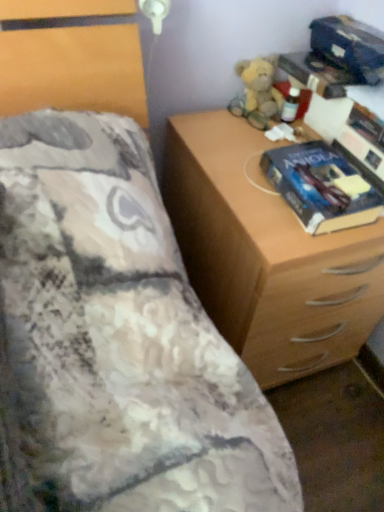
Describe the element at coordinates (266, 255) in the screenshot. I see `wooden chest of drawers at right` at that location.

I want to click on wooden chest of drawers at right, so click(266, 255).

This screenshot has width=384, height=512. Find the location of `fluffy beige teddy bear at upper right`. fluffy beige teddy bear at upper right is located at coordinates (257, 92).

Could you tell me if blue glossy paperback book at right is turned towards wooden chest of drawers at right?

No.

Considering the relative positions of blue glossy paperback book at right and wooden chest of drawers at right in the image provided, is blue glossy paperback book at right to the right of wooden chest of drawers at right from the viewer's perspective?

Yes.

Could fluffy beige teddy bear at upper right be considered to be inside blue glossy paperback book at right?

No, fluffy beige teddy bear at upper right is not a part of blue glossy paperback book at right.

Is blue glossy paperback book at right in front of or behind fluffy beige teddy bear at upper right in the image?

Clearly, blue glossy paperback book at right is in front of fluffy beige teddy bear at upper right.

Could you tell me if blue glossy paperback book at right is facing fluffy beige teddy bear at upper right?

No, blue glossy paperback book at right is not aimed at fluffy beige teddy bear at upper right.

Can you confirm if blue glossy paperback book at right is thinner than fluffy beige teddy bear at upper right?

Incorrect, the width of blue glossy paperback book at right is not less than that of fluffy beige teddy bear at upper right.

What's the angular difference between wooden chest of drawers at right and blue glossy paperback book at right's facing directions?

0.149 degrees.

Is wooden chest of drawers at right aimed at blue glossy paperback book at right?

No, wooden chest of drawers at right is not facing towards blue glossy paperback book at right.

Based on the photo, which is more to the right, wooden chest of drawers at right or blue glossy paperback book at right?

blue glossy paperback book at right.

Looking at this image, from a real-world perspective, is wooden chest of drawers at right on blue glossy paperback book at right?

No, from a real-world perspective, wooden chest of drawers at right is not on top of blue glossy paperback book at right.

In order to click on paperback book that appears below the fluffy beige teddy bear at upper right (from the image's perspective) in this screenshot , I will do `click(321, 187)`.

Measure the distance from fluffy beige teddy bear at upper right to blue glossy paperback book at right.

fluffy beige teddy bear at upper right and blue glossy paperback book at right are 11.21 inches apart.

Which of these two, fluffy beige teddy bear at upper right or blue glossy paperback book at right, is thinner?

With smaller width is fluffy beige teddy bear at upper right.

Can you see fluffy beige teddy bear at upper right touching blue glossy paperback book at right?

fluffy beige teddy bear at upper right is not next to blue glossy paperback book at right, and they're not touching.

In the image, is fluffy beige teddy bear at upper right on the left side or the right side of wooden chest of drawers at right?

From the image, it's evident that fluffy beige teddy bear at upper right is to the left of wooden chest of drawers at right.

Which of these two, fluffy beige teddy bear at upper right or wooden chest of drawers at right, is smaller?

fluffy beige teddy bear at upper right is smaller.

Would you say fluffy beige teddy bear at upper right is a long distance from wooden chest of drawers at right?

fluffy beige teddy bear at upper right is actually quite close to wooden chest of drawers at right.

Find the location of a particular element. toy that appears above the wooden chest of drawers at right (from a real-world perspective) is located at coordinates (257, 92).

From a real-world perspective, between wooden chest of drawers at right and fluffy beige teddy bear at upper right, who is vertically lower?

From a 3D spatial view, wooden chest of drawers at right is below.

How much distance is there between wooden chest of drawers at right and fluffy beige teddy bear at upper right?

13.60 inches.

Does point (228, 188) lie in front of point (272, 92)?

Yes, it is in front of point (272, 92).

Considering the sizes of objects wooden chest of drawers at right and fluffy beige teddy bear at upper right in the image provided, who is bigger, wooden chest of drawers at right or fluffy beige teddy bear at upper right?

With larger size is wooden chest of drawers at right.

Locate an element on the screen. The height and width of the screenshot is (512, 384). the chest of drawers below the blue glossy paperback book at right (from the image's perspective) is located at coordinates (266, 255).

Find the location of a particular element. The width and height of the screenshot is (384, 512). paperback book below the fluffy beige teddy bear at upper right (from a real-world perspective) is located at coordinates (321, 187).

From the image, which object appears to be farther from blue glossy paperback book at right, wooden chest of drawers at right or fluffy beige teddy bear at upper right?

fluffy beige teddy bear at upper right lies further to blue glossy paperback book at right than the other object.

From the image, which object appears to be farther from fluffy beige teddy bear at upper right, blue glossy paperback book at right or wooden chest of drawers at right?

The object further to fluffy beige teddy bear at upper right is wooden chest of drawers at right.

Which object lies further to the anchor point fluffy beige teddy bear at upper right, wooden chest of drawers at right or blue glossy paperback book at right?

wooden chest of drawers at right is positioned further to the anchor fluffy beige teddy bear at upper right.

Estimate the real-world distances between objects in this image. Which object is further from blue glossy paperback book at right, fluffy beige teddy bear at upper right or wooden chest of drawers at right?

fluffy beige teddy bear at upper right is positioned further to the anchor blue glossy paperback book at right.

From the image, which object appears to be farther from wooden chest of drawers at right, fluffy beige teddy bear at upper right or blue glossy paperback book at right?

fluffy beige teddy bear at upper right.

Considering their positions, is blue glossy paperback book at right positioned further to wooden chest of drawers at right than fluffy beige teddy bear at upper right?

Based on the image, fluffy beige teddy bear at upper right appears to be further to wooden chest of drawers at right.

Where is `paperback book between fluffy beige teddy bear at upper right and wooden chest of drawers at right vertically`? The image size is (384, 512). paperback book between fluffy beige teddy bear at upper right and wooden chest of drawers at right vertically is located at coordinates (321, 187).